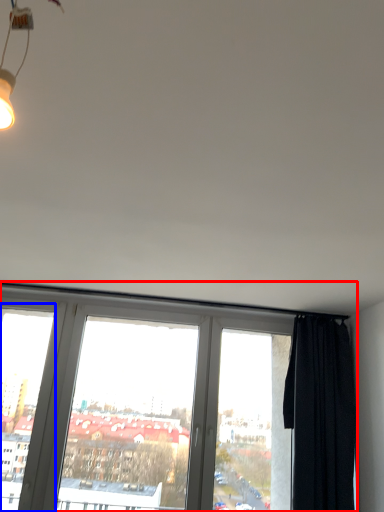
Question: Which object appears closest to the camera in this image, window (highlighted by a red box) or window frame (highlighted by a blue box)?

Choices:
 (A) window
 (B) window frame

Answer: (A)